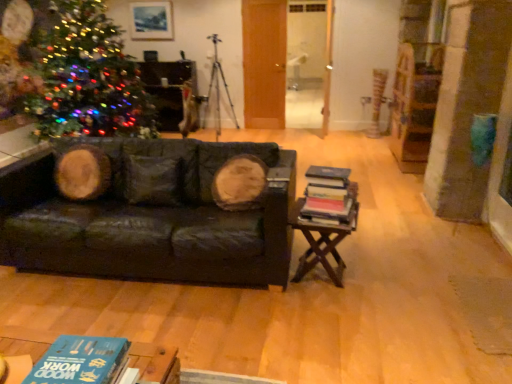
Where is `vacant area situated below wooden at right (from a real-world perspective)`? Image resolution: width=512 pixels, height=384 pixels. vacant area situated below wooden at right (from a real-world perspective) is located at coordinates (320, 283).